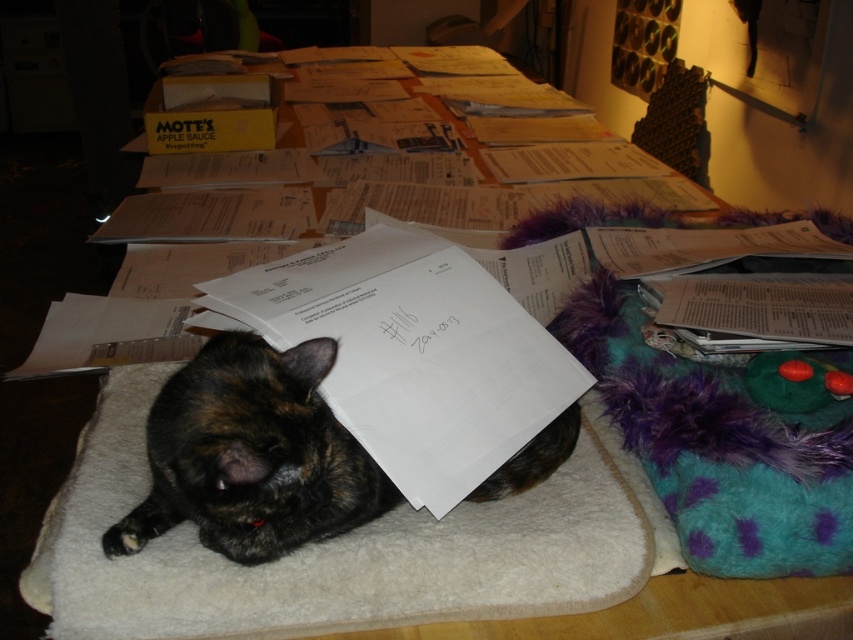
How much distance is there between white paper at center and tortoiseshell fur cat at center?

white paper at center and tortoiseshell fur cat at center are 10.97 centimeters apart.

Who is more distant from viewer, [392,426] or [317,525]?

The point [392,426] is behind.

From the picture: Measure the distance between point (x=525, y=381) and camera.

Point (x=525, y=381) and camera are 29.58 inches apart.

Image resolution: width=853 pixels, height=640 pixels. What are the coordinates of `white paper at center` in the screenshot? It's located at (410, 353).